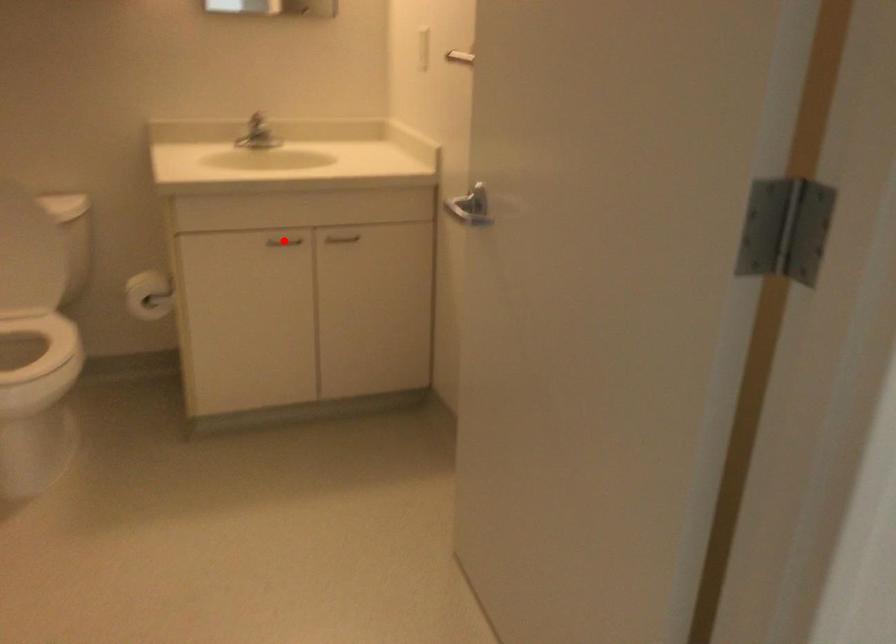
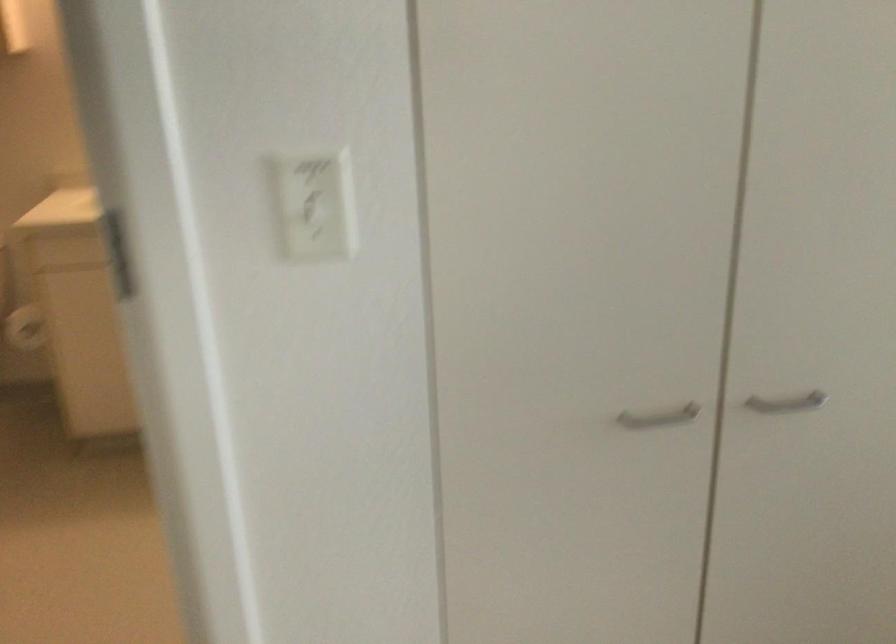
Question: I am providing you with two images of the same scene from different viewpoints. A red point is marked on the first image. Is the red point's position out of view in image 2?

Choices:
 (A) Yes
 (B) No

Answer: (A)